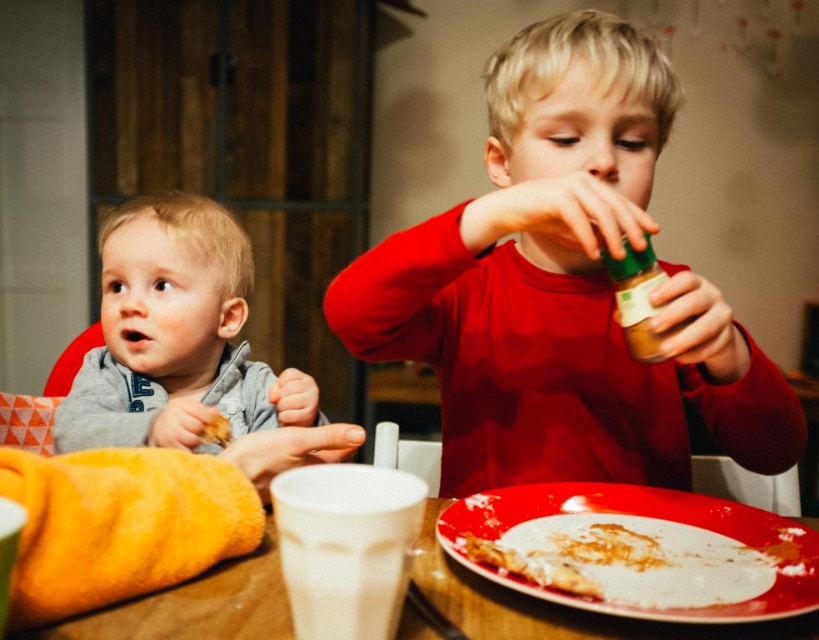
Is gray soft fabric toddler at left below wooden table at center?

Actually, gray soft fabric toddler at left is above wooden table at center.

At what (x,y) coordinates should I click in order to perform the action: click on gray soft fabric toddler at left. Please return your answer as a coordinate pair (x, y). Looking at the image, I should click on (175, 337).

Between wooden table at center and green matte jar at upper right, which one has less height?

Standing shorter between the two is wooden table at center.

Is point (197, 618) positioned behind point (663, 272)?

No, (197, 618) is in front of (663, 272).

The width and height of the screenshot is (819, 640). Find the location of `wooden table at center`. wooden table at center is located at coordinates (553, 605).

Between matte red shirt at center and gray soft fabric toddler at left, which one has less height?

Standing shorter between the two is gray soft fabric toddler at left.

Can you confirm if matte red shirt at center is bigger than gray soft fabric toddler at left?

Yes, matte red shirt at center is bigger than gray soft fabric toddler at left.

Where is `matte red shirt at center`? The image size is (819, 640). matte red shirt at center is located at coordinates (564, 288).

You are a GUI agent. You are given a task and a screenshot of the screen. Output one action in this format:
    pyautogui.click(x=<x>, y=<y>)
    Task: Click on the matte red shirt at center
    This screenshot has height=640, width=819.
    Given the screenshot: What is the action you would take?
    pyautogui.click(x=564, y=288)